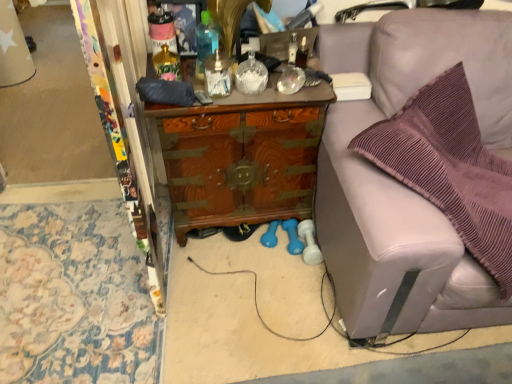
Question: From the image's perspective, is matte pink plastic bottle at upper center, marked as the fifth bottle in a right-to-left arrangement, above wooden chest at center?

Choices:
 (A) yes
 (B) no

Answer: (A)

Question: Is matte pink plastic bottle at upper center, the 1th bottle viewed from the left, at the right side of wooden chest at center?

Choices:
 (A) no
 (B) yes

Answer: (A)

Question: Could you tell me if matte pink plastic bottle at upper center, marked as the fifth bottle in a right-to-left arrangement, is facing wooden chest at center?

Choices:
 (A) yes
 (B) no

Answer: (B)

Question: From a real-world perspective, is matte pink plastic bottle at upper center, marked as the fifth bottle in a right-to-left arrangement, positioned under wooden chest at center based on gravity?

Choices:
 (A) no
 (B) yes

Answer: (A)

Question: From the image's perspective, would you say matte pink plastic bottle at upper center, the 1th bottle viewed from the left, is shown under wooden chest at center?

Choices:
 (A) yes
 (B) no

Answer: (B)

Question: Considering the positions of translucent glass vase at center, placed as the 4th bottle when sorted from right to left, and translucent blue bottle at center, placed as the 3th bottle when sorted from right to left, in the image, is translucent glass vase at center, placed as the 4th bottle when sorted from right to left, taller or shorter than translucent blue bottle at center, placed as the 3th bottle when sorted from right to left,?

Choices:
 (A) tall
 (B) short

Answer: (B)

Question: In the image, is translucent glass vase at center, the second bottle from the left, positioned in front of or behind translucent blue bottle at center, the third bottle when ordered from left to right?

Choices:
 (A) front
 (B) behind

Answer: (A)

Question: Considering the relative positions of translucent glass vase at center, placed as the 4th bottle when sorted from right to left, and translucent blue bottle at center, the third bottle when ordered from left to right, in the image provided, is translucent glass vase at center, placed as the 4th bottle when sorted from right to left, to the left or to the right of translucent blue bottle at center, the third bottle when ordered from left to right,?

Choices:
 (A) right
 (B) left

Answer: (B)

Question: In terms of width, does translucent glass vase at center, the second bottle from the left, look wider or thinner when compared to translucent blue bottle at center, placed as the 3th bottle when sorted from right to left?

Choices:
 (A) wide
 (B) thin

Answer: (A)

Question: From a real-world perspective, is clear glass soap dispenser at center, the 2th bottle from the right, positioned above or below translucent blue bottle at center, the third bottle when ordered from left to right?

Choices:
 (A) below
 (B) above

Answer: (A)

Question: Is clear glass soap dispenser at center, the 2th bottle from the right, to the left or to the right of translucent blue bottle at center, the third bottle when ordered from left to right, in the image?

Choices:
 (A) left
 (B) right

Answer: (B)

Question: From the image's perspective, is clear glass soap dispenser at center, positioned as the 4th bottle in left-to-right order, positioned above or below translucent blue bottle at center, placed as the 3th bottle when sorted from right to left?

Choices:
 (A) below
 (B) above

Answer: (A)

Question: Is point (215, 84) positioned closer to the camera than point (205, 21)?

Choices:
 (A) farther
 (B) closer

Answer: (B)

Question: From the image's perspective, is clear glass jar at center, which is the 5th bottle in left-to-right order, positioned above or below translucent glass vase at center, the second bottle from the left?

Choices:
 (A) below
 (B) above

Answer: (A)

Question: Is point (241, 61) closer or farther from the camera than point (177, 76)?

Choices:
 (A) closer
 (B) farther

Answer: (B)